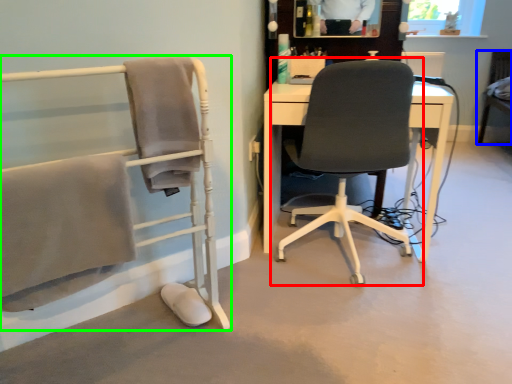
Question: Considering the real-world distances, which object is farthest from chair (highlighted by a red box)? chair (highlighted by a blue box) or chair (highlighted by a green box)?

Choices:
 (A) chair
 (B) chair

Answer: (A)